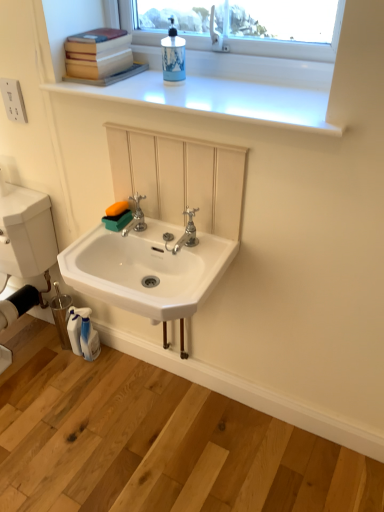
Question: Which direction should I rotate to face polished chrome faucet at center, positioned as the 1th tap in right-to-left order, — up or down?

Choices:
 (A) up
 (B) down

Answer: (A)

Question: Should I look upward or downward to see blue ceramic soap dispenser at upper center?

Choices:
 (A) down
 (B) up

Answer: (B)

Question: Is blue ceramic soap dispenser at upper center smaller than silver metallic faucet at center, the second tap from the right?

Choices:
 (A) yes
 (B) no

Answer: (B)

Question: Does blue ceramic soap dispenser at upper center lie in front of silver metallic faucet at center, marked as the 1th tap in a left-to-right arrangement?

Choices:
 (A) no
 (B) yes

Answer: (B)

Question: Can you confirm if blue ceramic soap dispenser at upper center is bigger than silver metallic faucet at center, the second tap from the right?

Choices:
 (A) yes
 (B) no

Answer: (A)

Question: From a real-world perspective, is blue ceramic soap dispenser at upper center physically below silver metallic faucet at center, marked as the 1th tap in a left-to-right arrangement?

Choices:
 (A) no
 (B) yes

Answer: (A)

Question: Is blue ceramic soap dispenser at upper center located outside silver metallic faucet at center, marked as the 1th tap in a left-to-right arrangement?

Choices:
 (A) yes
 (B) no

Answer: (A)

Question: Is blue ceramic soap dispenser at upper center far away from silver metallic faucet at center, marked as the 1th tap in a left-to-right arrangement?

Choices:
 (A) no
 (B) yes

Answer: (A)

Question: Is white glossy window sill at upper center facing away from hardcover books at upper left?

Choices:
 (A) yes
 (B) no

Answer: (B)

Question: Can you confirm if white glossy window sill at upper center is shorter than hardcover books at upper left?

Choices:
 (A) yes
 (B) no

Answer: (A)

Question: Is white glossy window sill at upper center closer to the viewer compared to hardcover books at upper left?

Choices:
 (A) no
 (B) yes

Answer: (B)

Question: Is white glossy window sill at upper center facing towards hardcover books at upper left?

Choices:
 (A) yes
 (B) no

Answer: (B)

Question: Does white glossy window sill at upper center appear on the left side of hardcover books at upper left?

Choices:
 (A) yes
 (B) no

Answer: (B)

Question: Are white glossy window sill at upper center and hardcover books at upper left far apart?

Choices:
 (A) no
 (B) yes

Answer: (A)

Question: From the image's perspective, does blue ceramic soap dispenser at upper center appear lower than white plastic electrical outlet at upper left?

Choices:
 (A) no
 (B) yes

Answer: (A)